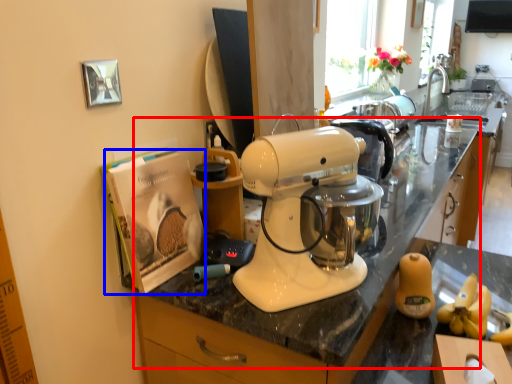
Question: Among these objects, which one is farthest to the camera, countertop (highlighted by a red box) or magazine (highlighted by a blue box)?

Choices:
 (A) countertop
 (B) magazine

Answer: (B)